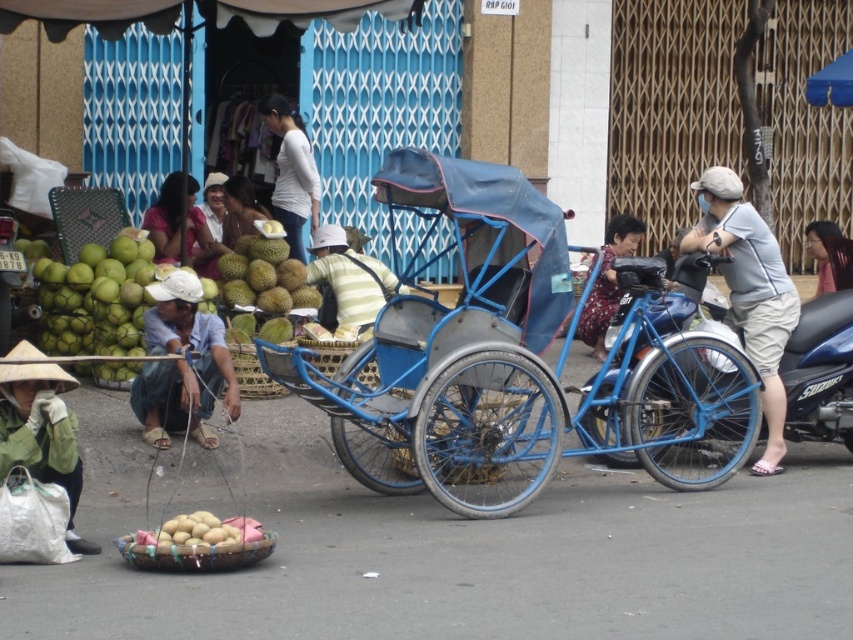
Question: Among these points, which one is nearest to the camera?

Choices:
 (A) (270, 257)
 (B) (161, 250)

Answer: (A)

Question: Is light gray fabric shirt at center right positioned at the back of yellow matte potatoes at lower center?

Choices:
 (A) no
 (B) yes

Answer: (B)

Question: Where is matte white hat at upper center located in relation to smooth black hair at upper right in the image?

Choices:
 (A) above
 (B) below

Answer: (A)

Question: Does yellow-green durian at center have a larger size compared to green rough durian at center?

Choices:
 (A) no
 (B) yes

Answer: (B)

Question: Which point is farther from the camera taking this photo?

Choices:
 (A) (286, 262)
 (B) (489, 458)
 (C) (97, 360)

Answer: (A)

Question: Which of the following is the closest to the observer?

Choices:
 (A) blue metallic rickshaw at center
 (B) yellow-green durian at center

Answer: (A)